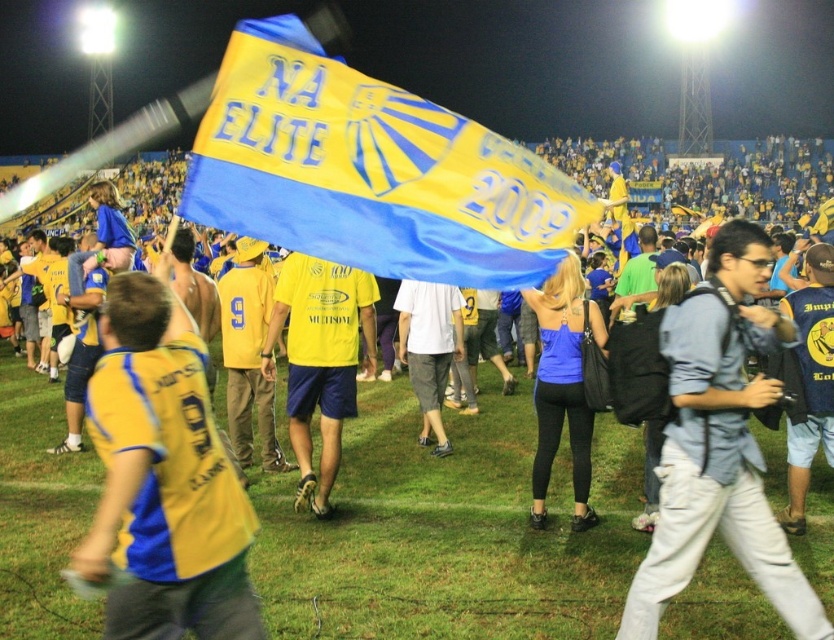
You are a photographer standing at the front of the stadium, and you want to take a photo that includes both the light blue denim shirt at center and the yellow matte shirt at center. Given that your camera has a maximum focus range of 3 meters, will you be able to capture both shirts in the same frame without moving your position?

The light blue denim shirt at center and yellow matte shirt at center are 3.49 meters apart from each other. Since the distance between them exceeds the camera maximum focus range of 3 meters, you won not be able to capture both shirts in the same frame without moving your position.

You are a photographer at the stadium and want to capture a photo that includes both the yellow fabric flag at center and the yellow jersey at center. Which object should you adjust your camera focus on first to ensure both are in the frame?

You should focus on the yellow fabric flag at center first since it is closer to you than the yellow jersey at center, ensuring both are in the frame.